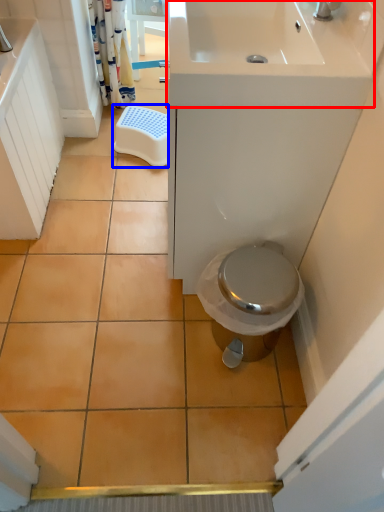
Question: Which object appears farthest to the camera in this image, sink (highlighted by a red box) or step stool (highlighted by a blue box)?

Choices:
 (A) sink
 (B) step stool

Answer: (B)